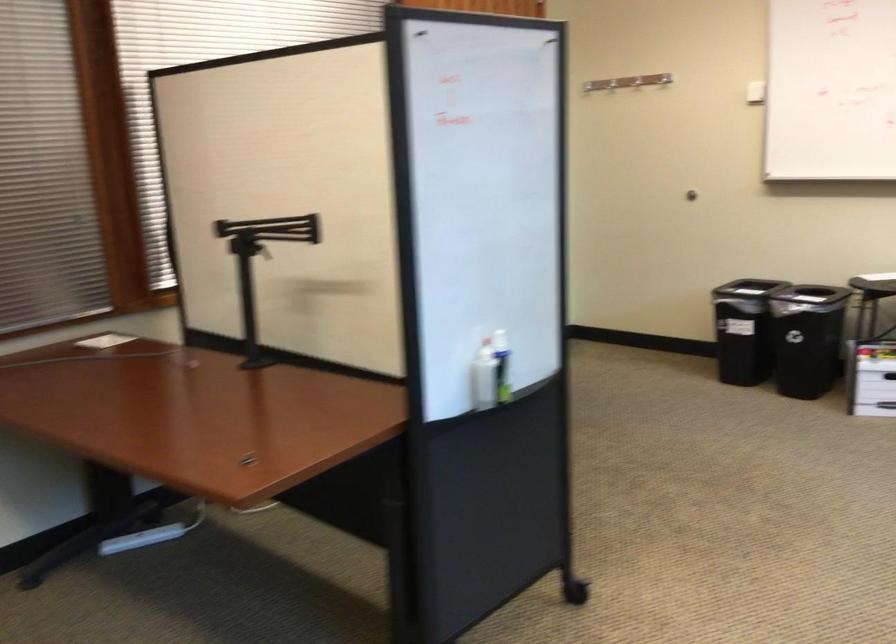
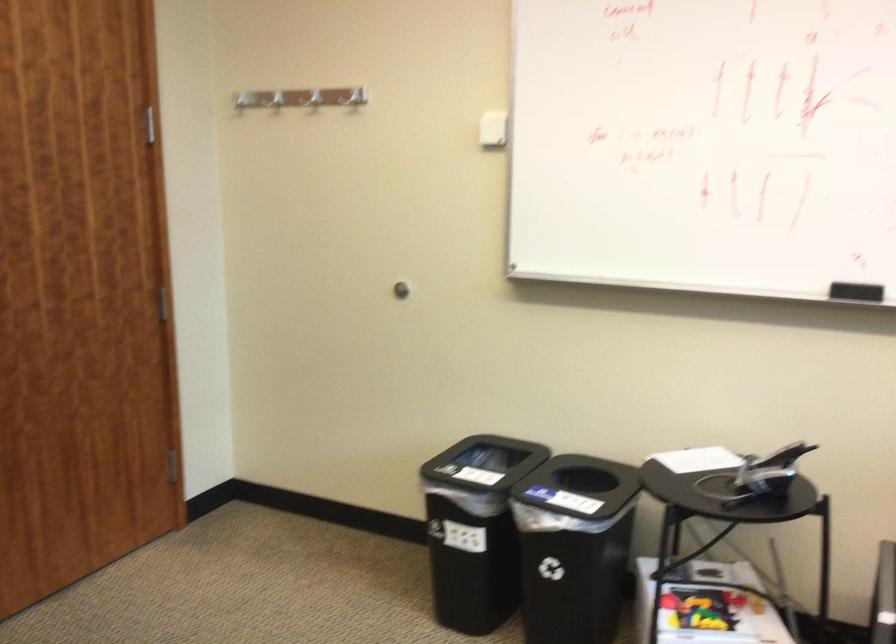
Locate, in the second image, the point that corresponds to point (675, 86) in the first image.

(493, 129)